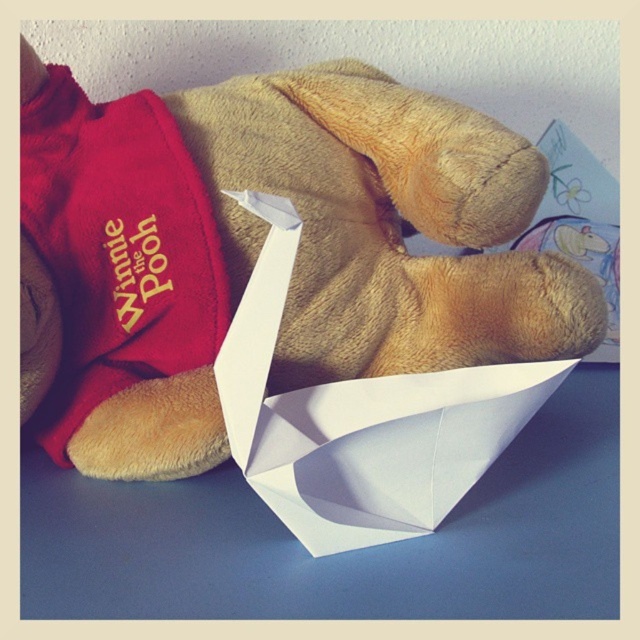
Does point (200, 436) come in front of point (460, 397)?

No.

Does soft plush teddy bear at center appear on the left side of white paper boat at center?

Correct, you'll find soft plush teddy bear at center to the left of white paper boat at center.

Describe the element at coordinates (296, 257) in the screenshot. The width and height of the screenshot is (640, 640). I see `soft plush teddy bear at center` at that location.

You are a GUI agent. You are given a task and a screenshot of the screen. Output one action in this format:
    pyautogui.click(x=<x>, y=<y>)
    Task: Click on the soft plush teddy bear at center
    The image size is (640, 640).
    Given the screenshot: What is the action you would take?
    click(296, 257)